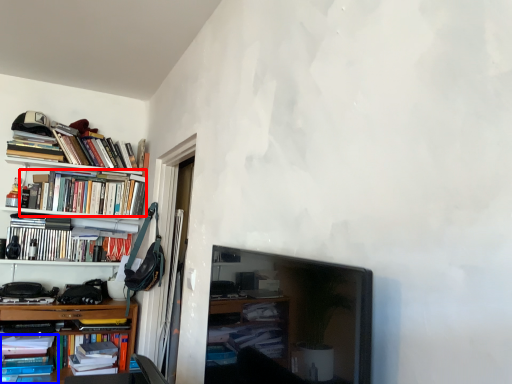
Question: Among these objects, which one is nearest to the camera, book (highlighted by a red box) or book (highlighted by a blue box)?

Choices:
 (A) book
 (B) book

Answer: (B)